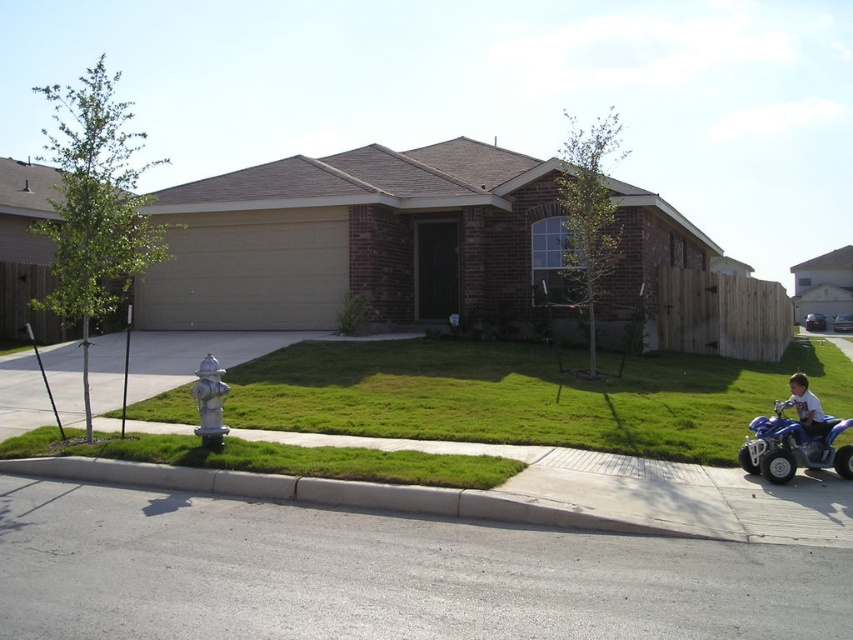
You are a delivery person approaching the house and need to park your vehicle. The driveway is narrow. You see a blue plastic quad bike at lower right and a silver metallic fire hydrant at lower left. Which object is closer to the driveway entrance?

The silver metallic fire hydrant at lower left is closer to the driveway entrance because the blue plastic quad bike at lower right is positioned on the right side of it, meaning the fire hydrant is between the driveway entrance and the quad bike.

You are standing at the point with coordinates point (811, 316) and want to walk to the front door of the house. Which direction should you move relative to point (201, 380)?

You should move towards point (201, 380) because it is in front of point (811, 316), so moving toward it would lead you toward the front door.

You are a gardener planning to mow the lawn. You see the green grass at lower center and the silver metallic fire hydrant at lower left. Which area should you avoid mowing to prevent damaging the fire hydrant?

You should avoid mowing near the silver metallic fire hydrant at lower left because the green grass at lower center is larger in size and more suitable for mowing without interfering with the hydrant.